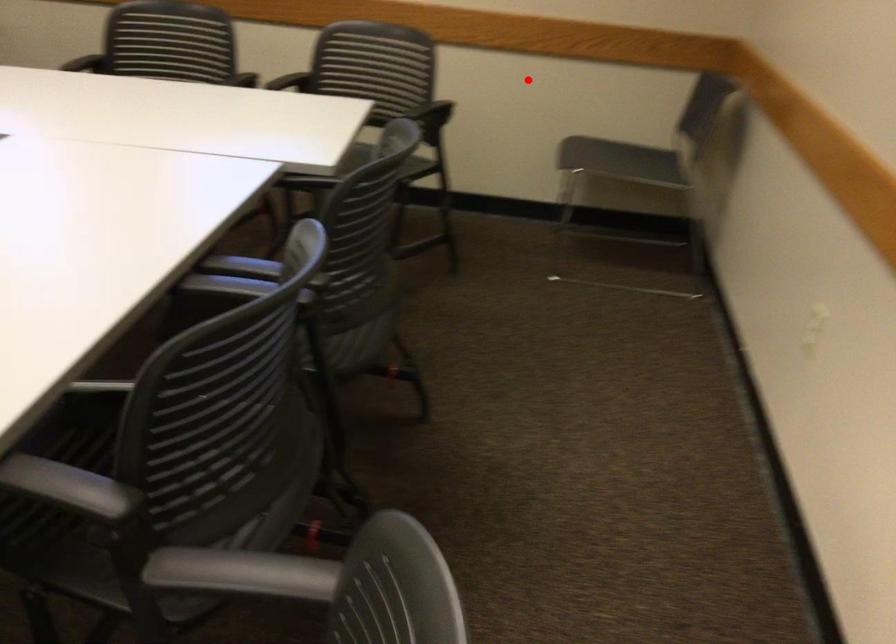
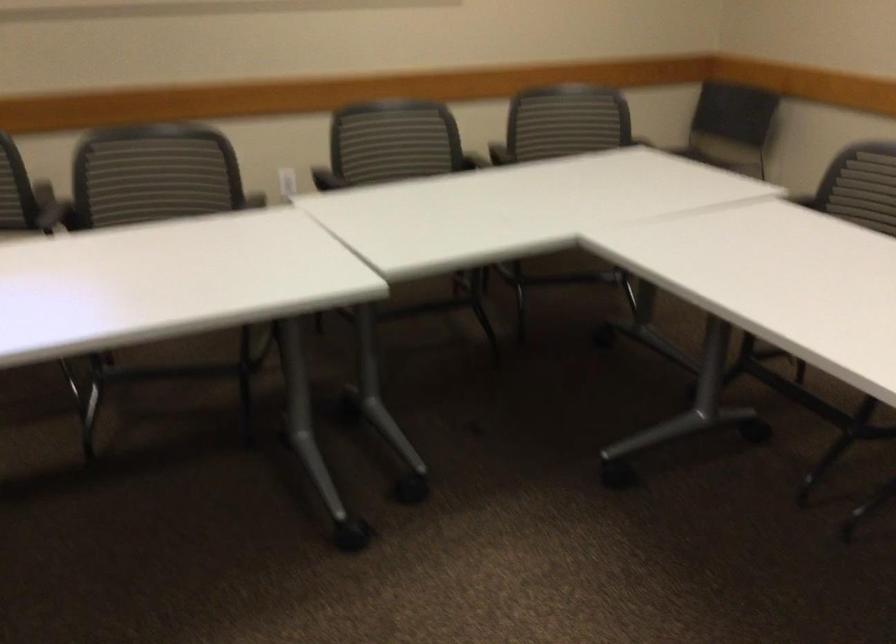
Question: I am providing you with two images of the same scene from different viewpoints. Image1 has a red point marked. In image2, the corresponding 3D location appears at what relative position? Reply with the corresponding letter.

Choices:
 (A) Closer
 (B) Farther

Answer: (B)